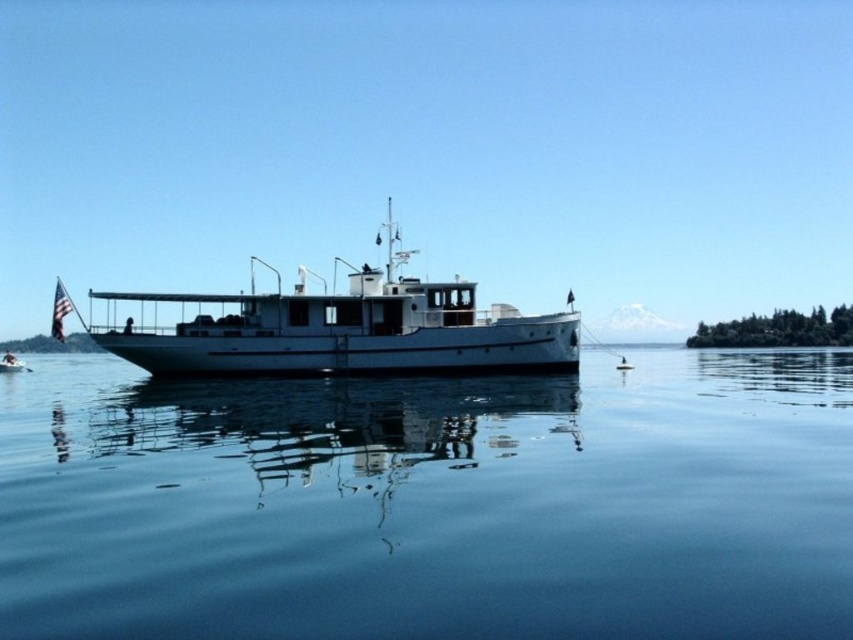
Which of these two, white matte boat at center or white glossy boat at left, stands shorter?

A: white glossy boat at left

Is the position of white matte boat at center less distant than that of white glossy boat at left?

Yes, white matte boat at center is closer to the viewer.

Describe the element at coordinates (346, 330) in the screenshot. I see `white matte boat at center` at that location.

Locate an element on the screen. Image resolution: width=853 pixels, height=640 pixels. white matte boat at center is located at coordinates (346, 330).

Between point (485, 381) and point (1, 369), which one is positioned in front?

Point (485, 381)

Is the position of transparent blue water at center less distant than that of white glossy boat at left?

Yes, it is.

At what (x,y) coordinates should I click in order to perform the action: click on transparent blue water at center. Please return your answer as a coordinate pair (x, y). The height and width of the screenshot is (640, 853). Looking at the image, I should click on (431, 502).

This screenshot has height=640, width=853. Identify the location of transparent blue water at center. (431, 502).

In the scene shown: Can you confirm if transparent blue water at center is bigger than white matte boat at center?

Actually, transparent blue water at center might be smaller than white matte boat at center.

Locate an element on the screen. This screenshot has width=853, height=640. transparent blue water at center is located at coordinates (431, 502).